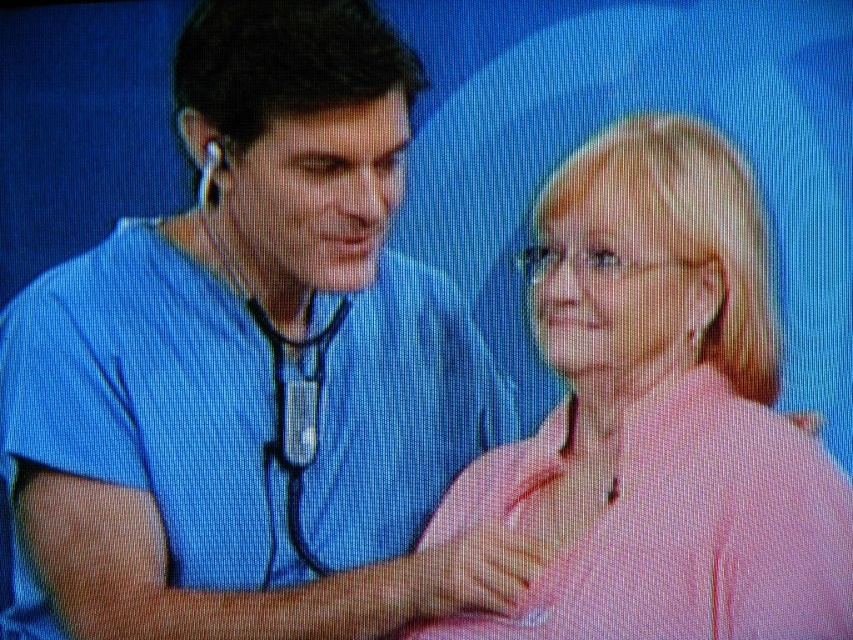
You are a photographer trying to capture a close up shot of the matte black stethoscope at center. Given that the matte blue shirt at center is blocking part of the stethoscope, can you adjust your angle to focus on the stethoscope without moving the subjects?

The matte blue shirt at center is much taller than the matte black stethoscope at center, so adjusting the angle might not be sufficient to fully capture the stethoscope without obstruction. Consider moving closer or repositioning to find an unobstructed view.

You are a nurse looking at a patient monitor and see the matte blue shirt at center and the matte black stethoscope at center. Which object is positioned to the right side of the monitor?

The matte black stethoscope at center is positioned to the right side of the monitor because the matte blue shirt at center is to the left of it.

You are a medical student observing a video on a TV screen. You notice the matte blue shirt at center and the matte black stethoscope at center. Which object is closer to the camera in the video?

The matte blue shirt at center is in front of the matte black stethoscope at center, so the matte blue shirt at center is closer to the camera in the video.